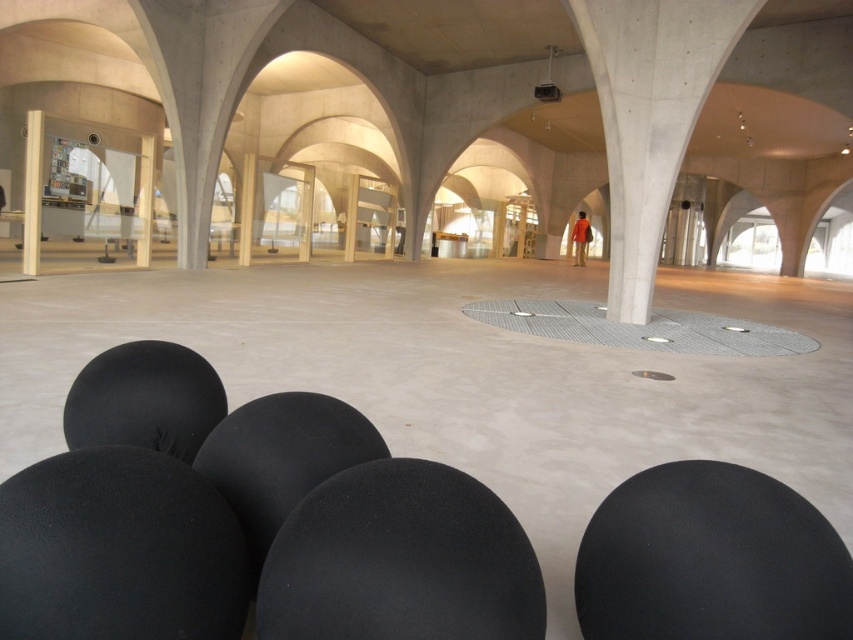
You are standing at the entrance of this modern indoor space and notice two points marked on the floor. The first point is at coordinates point (28, 113) and the second is at point (142, 212). If you want to walk from the entrance towards the center of the room, which point will you encounter first?

Point (28, 113) is in front of point (142, 212), so you will encounter point (28, 113) first as you walk towards the center of the room.

You are an architect designing a new installation that requires placing a 10 feet wide sculpture between the white smooth pillar at left and the matte gray pillar at center. Based on the distance between them, will there be enough space to place the sculpture without it touching either pillar?

The white smooth pillar at left is 31.51 feet from the matte gray pillar at center. Subtracting the sculpture width of 10 feet, the remaining space would be 21.51 feet. Since this distance is more than enough to place the sculpture without it touching either pillar, there is sufficient space.

Consider the image. You are standing at the entrance of the space and want to locate the white smooth pillar at left. According to the coordinates provided, where should you look first?

The white smooth pillar at left is located at point (32, 192), so you should look towards the lower left area of the space to find it.